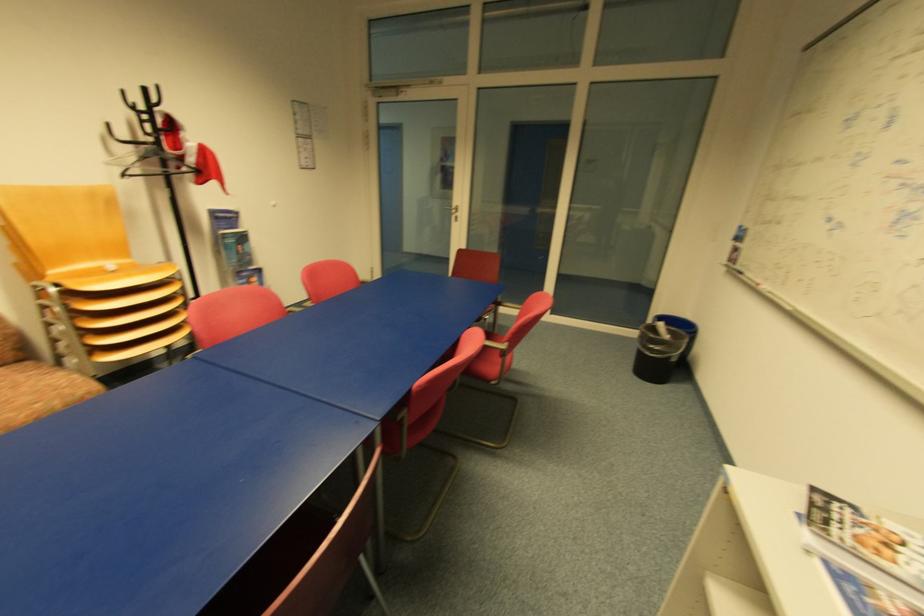
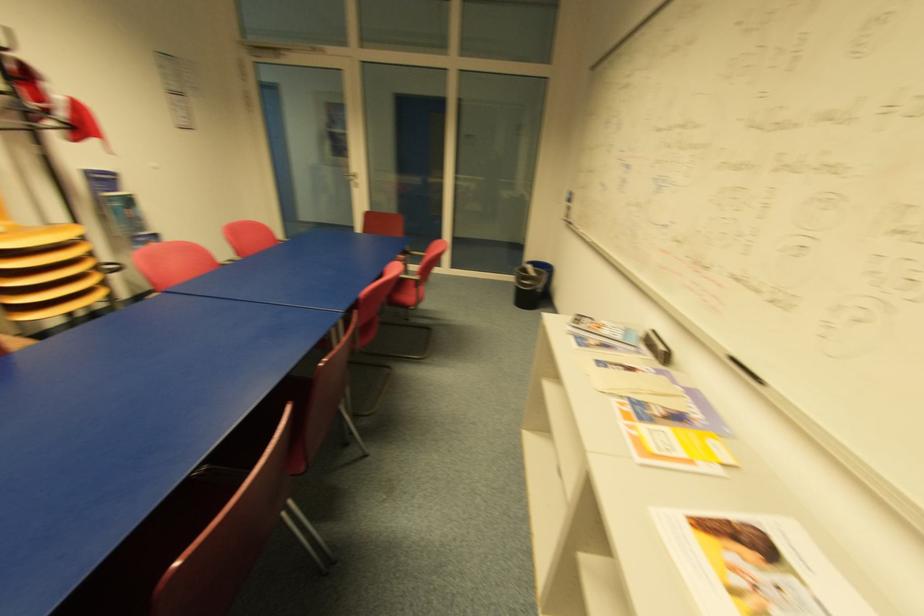
Question: Which direction would the cameraman need to move to produce the second image? Reply with the corresponding letter.

Choices:
 (A) Left
 (B) Right
 (C) Forward
 (D) Backward

Answer: (D)